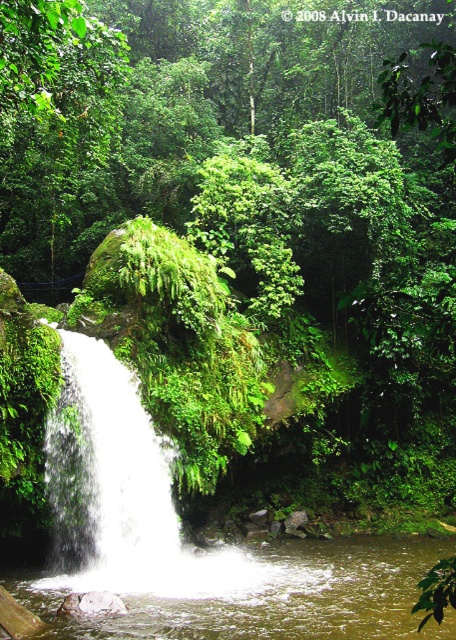
Can you confirm if clear water at center is positioned below white frothy water at left?

Yes.

This screenshot has width=456, height=640. What do you see at coordinates (269, 595) in the screenshot?
I see `clear water at center` at bounding box center [269, 595].

Where is `clear water at center`? clear water at center is located at coordinates (269, 595).